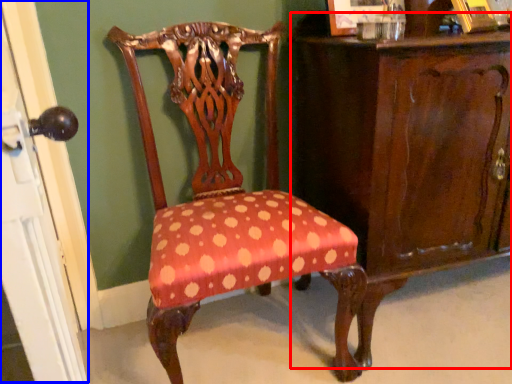
Question: Among these objects, which one is farthest to the camera, vanity (highlighted by a red box) or screen door (highlighted by a blue box)?

Choices:
 (A) vanity
 (B) screen door

Answer: (A)